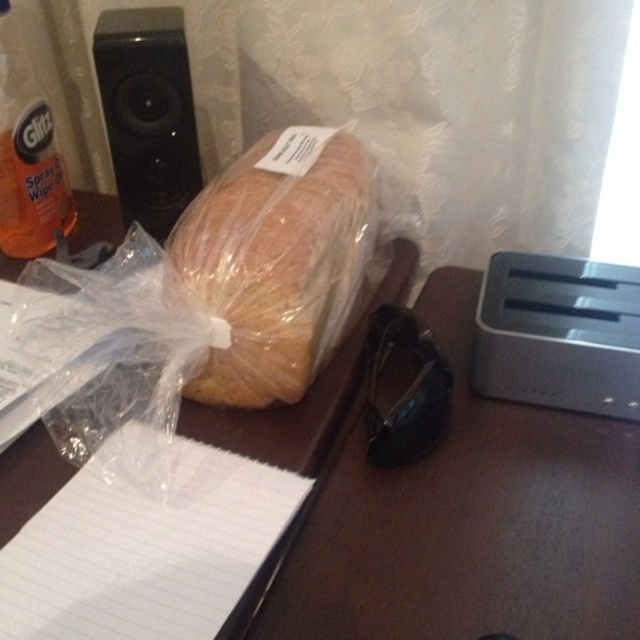
Question: Is black plastic speaker at upper left thinner than orange matte spray wipes at left?

Choices:
 (A) yes
 (B) no

Answer: (B)

Question: Which point is farther to the camera?

Choices:
 (A) clear plastic bread at center
 (B) black plastic speaker at upper left

Answer: (B)

Question: Which of the following is the farthest from the observer?

Choices:
 (A) (550, 436)
 (B) (344, 307)
 (C) (106, 67)
 (D) (3, 128)

Answer: (D)

Question: Which point is farther from the camera taking this photo?

Choices:
 (A) (129, 164)
 (B) (132, 531)
 (C) (29, 132)

Answer: (C)

Question: Does clear plastic bread at center have a larger size compared to black plastic speaker at upper left?

Choices:
 (A) yes
 (B) no

Answer: (A)

Question: Does black plastic speaker at upper left lie in front of orange matte spray wipes at left?

Choices:
 (A) no
 (B) yes

Answer: (B)